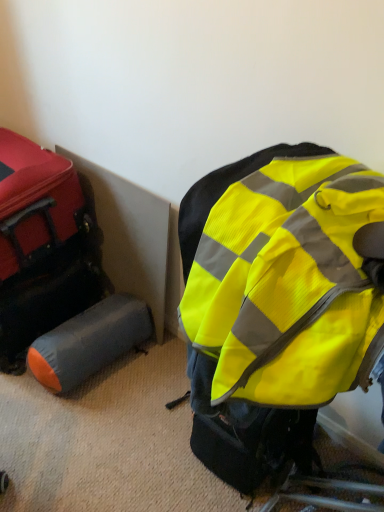
Question: Is point (39, 356) positioned closer to the camera than point (49, 243)?

Choices:
 (A) farther
 (B) closer

Answer: (B)

Question: From the image's perspective, relative to matte red suitcase at left, marked as the first luggage in a top-to-bottom arrangement, is gray fabric cylinder at lower left, the second luggage from the top, above or below?

Choices:
 (A) above
 (B) below

Answer: (B)

Question: Based on their relative distances, which object is farther from the gray fabric cylinder at lower left, which is counted as the 1th luggage, starting from the bottom?

Choices:
 (A) orange-gray fabric sleeping bag at lower left
 (B) high-visibility fabric backpack at center
 (C) matte red suitcase at left, placed as the second luggage when sorted from bottom to top

Answer: (B)

Question: Based on their relative distances, which object is nearer to the high-visibility fabric backpack at center?

Choices:
 (A) gray fabric cylinder at lower left, which is counted as the 1th luggage, starting from the bottom
 (B) matte red suitcase at left, placed as the second luggage when sorted from bottom to top
 (C) orange-gray fabric sleeping bag at lower left

Answer: (A)